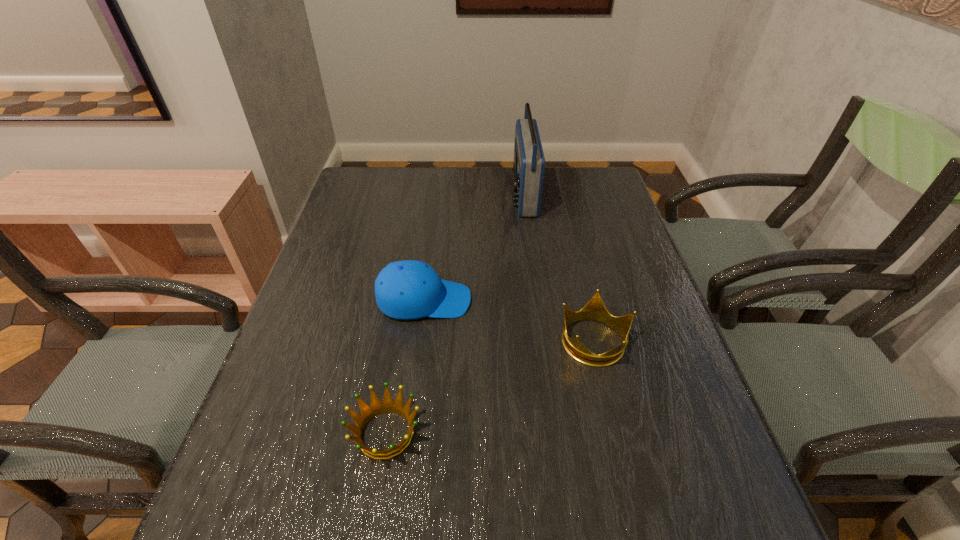
This screenshot has width=960, height=540. I want to click on the tallest object, so click(x=529, y=162).

This screenshot has width=960, height=540. In order to click on the farthest object in this screenshot , I will do `click(529, 162)`.

Where is `cap`? The image size is (960, 540). cap is located at coordinates (409, 289).

Locate an element on the screen. The width and height of the screenshot is (960, 540). the farther crown is located at coordinates (595, 309).

This screenshot has width=960, height=540. In order to click on the taller crown in this screenshot , I will do `click(595, 309)`.

Identify the location of the shorter crown. The width and height of the screenshot is (960, 540). (387, 405).

Where is `the nearer crown`? This screenshot has height=540, width=960. the nearer crown is located at coordinates (387, 405).

Locate an element on the screen. The height and width of the screenshot is (540, 960). vacant region located 0.380m on the front panel of the farthest object is located at coordinates (394, 194).

Identify the location of vacant space situated 0.370m on the front panel of the farthest object. (396, 194).

I want to click on vacant space located on the front panel of the farthest object, so click(x=456, y=194).